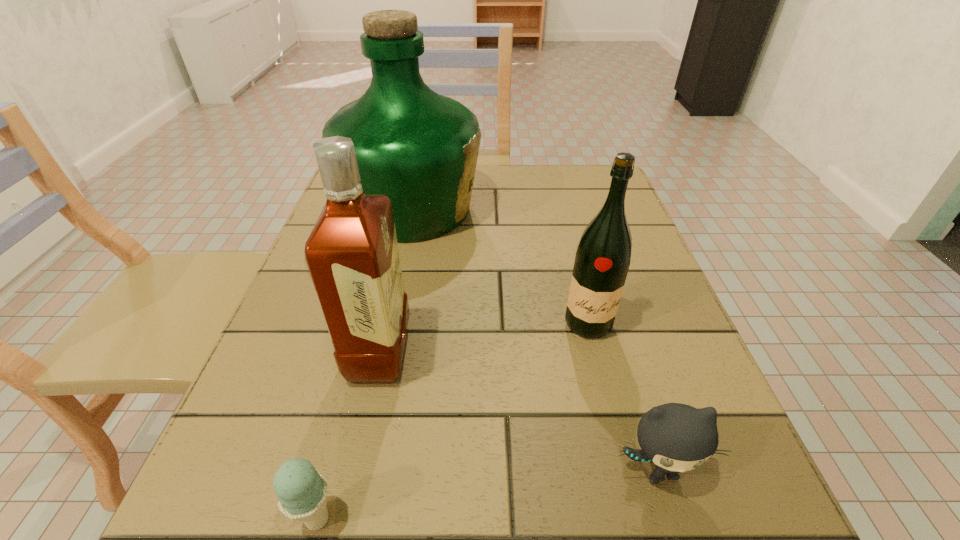
Where is `the farthest liquor`? The height and width of the screenshot is (540, 960). the farthest liquor is located at coordinates (419, 148).

Locate an element on the screen. the rightmost liquor is located at coordinates pyautogui.click(x=602, y=260).

The width and height of the screenshot is (960, 540). I want to click on kitten, so 676,437.

Where is `vacant space positioned on the label side of the farthest liquor`? Image resolution: width=960 pixels, height=540 pixels. vacant space positioned on the label side of the farthest liquor is located at coordinates (612, 210).

You are a GUI agent. You are given a task and a screenshot of the screen. Output one action in this format:
    pyautogui.click(x=<x>, y=<y>)
    Task: Click on the vacant space positioned on the front-facing side of the rightmost liquor
    This screenshot has width=960, height=540.
    Given the screenshot: What is the action you would take?
    pyautogui.click(x=611, y=415)

The image size is (960, 540). I want to click on object that is at the far edge, so click(419, 148).

This screenshot has width=960, height=540. Identify the location of object that is at the near edge. (676, 437).

This screenshot has height=540, width=960. In order to click on liquor present at the right edge in this screenshot , I will do pos(602,260).

I want to click on kitten present at the right edge, so click(676, 437).

Find the location of `object present at the far left corner`. object present at the far left corner is located at coordinates (419, 148).